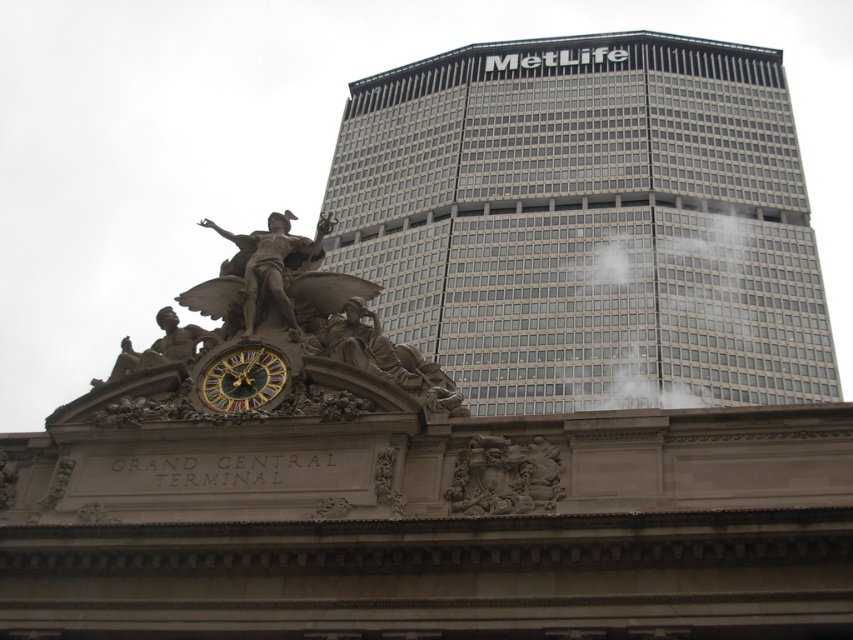
You are standing in front of Grand Central Terminal and the MetLife Building. You notice two points marked in the image. The first point is at coordinate point (468, 260) and the second is at point (276, 212). Which point is closer to you?

Point (468, 260) is closer to you because it is further to the viewer than point (276, 212).

You are an architect visiting New York City and want to take a photo of both the gray glass skyscraper at upper right and the polished bronze statue at center. Which object should you focus on first to ensure both are in the frame?

You should focus on the gray glass skyscraper at upper right first because it is taller than the polished bronze statue at center, so positioning the camera to include its full height will naturally include the statue in the frame as well.